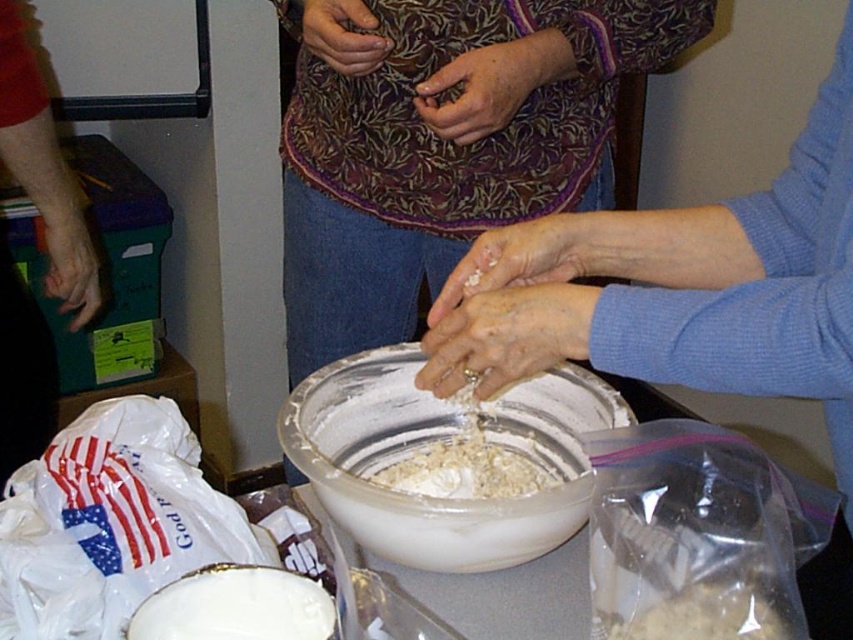
You are a photographer trying to capture a close detail shot of the white matte hands at center in the kitchen scene. Given that the hands are 25.85 inches away from the camera, would you consider this distance appropriate for a detailed closeup, or should you move closer or farther away?

The distance between the white matte hands at center and the camera is 25.85 inches. For a detailed closeup, this distance may be considered appropriate depending on the lens used, but typically, moving closer could enhance detail. However, without changing equipment, maintaining this distance ensures the hands remain the focal point without distortion.

You are a chef observing the kitchen scene. You need to place a new ingredient into the white matte bowl at center and then cover it with the matte floral fabric at center. Based on their positions, which object should you interact with first?

The white matte bowl at center is closer to the viewer than the matte floral fabric at center, so you should place the ingredient into the white matte bowl first before reaching for the matte floral fabric.